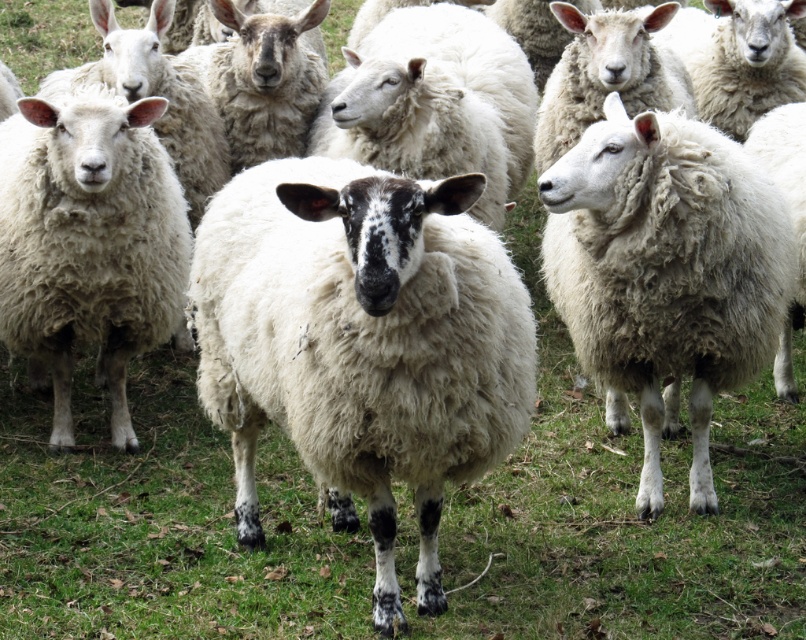
From the picture: Does white woolen sheep at center appear under fuzzy white sheep at center?

Yes, white woolen sheep at center is below fuzzy white sheep at center.

Between white woolen sheep at center and fuzzy white sheep at center, which one has more height?

With more height is white woolen sheep at center.

The image size is (806, 640). In order to click on white woolen sheep at center in this screenshot , I will do `click(360, 344)`.

The image size is (806, 640). Identify the location of white woolen sheep at center. (360, 344).

Can you confirm if white woolen sheep at center is positioned to the left of white woolly sheep at right?

Indeed, white woolen sheep at center is positioned on the left side of white woolly sheep at right.

Can you confirm if white woolen sheep at center is wider than white woolly sheep at right?

Yes.

Where is `white woolen sheep at center`? white woolen sheep at center is located at coordinates (360, 344).

Locate an element on the screen. white woolen sheep at center is located at coordinates (360, 344).

Can you confirm if white woolly sheep at right is positioned to the right of fuzzy white sheep at center?

Yes, white woolly sheep at right is to the right of fuzzy white sheep at center.

Who is positioned more to the left, white woolly sheep at right or fuzzy white sheep at center?

fuzzy white sheep at center is more to the left.

The image size is (806, 640). What do you see at coordinates (667, 269) in the screenshot?
I see `white woolly sheep at right` at bounding box center [667, 269].

I want to click on white woolly sheep at right, so click(667, 269).